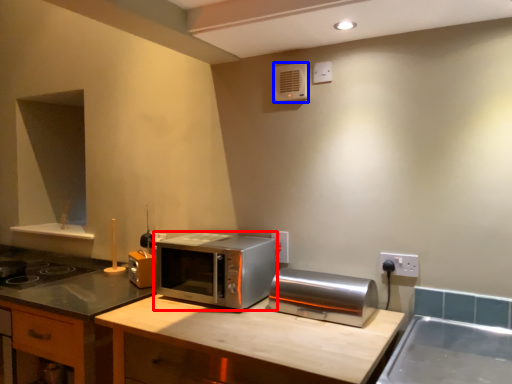
Question: Among these objects, which one is farthest to the camera, microwave oven (highlighted by a red box) or air conditioner (highlighted by a blue box)?

Choices:
 (A) microwave oven
 (B) air conditioner

Answer: (B)